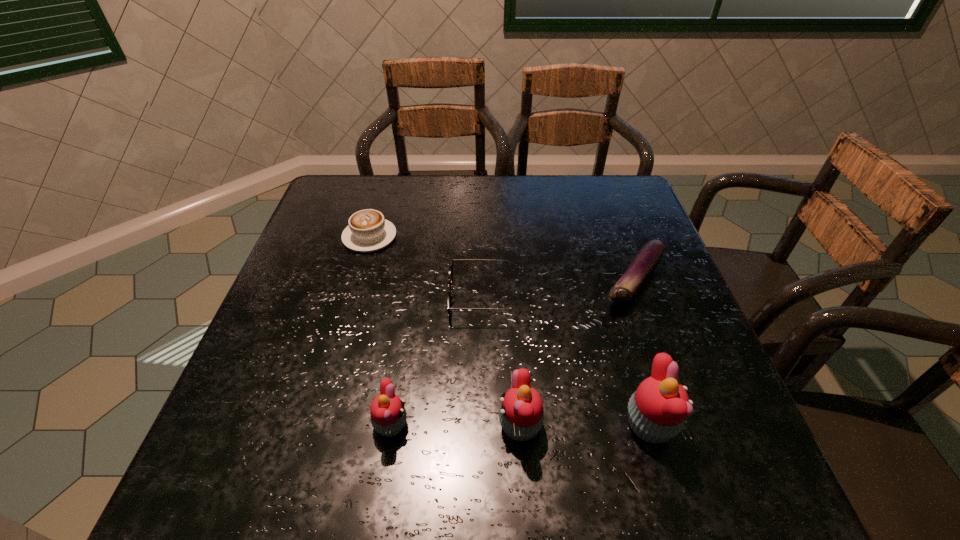
The width and height of the screenshot is (960, 540). In order to click on the leftmost cupcake in this screenshot , I will do `click(388, 415)`.

This screenshot has height=540, width=960. I want to click on the fourth shortest object, so click(x=388, y=415).

At what (x,y) coordinates should I click in order to perform the action: click on the second cupcake from left to right. Please return your answer as a coordinate pair (x, y). The height and width of the screenshot is (540, 960). Looking at the image, I should click on (521, 415).

The height and width of the screenshot is (540, 960). Find the location of `the second shortest cupcake`. the second shortest cupcake is located at coordinates (521, 415).

Where is `the tallest object`? The width and height of the screenshot is (960, 540). the tallest object is located at coordinates (656, 412).

Find the location of a particular element. This screenshot has height=540, width=960. the rightmost cupcake is located at coordinates (656, 412).

The width and height of the screenshot is (960, 540). I want to click on the leftmost object, so [x=367, y=231].

The image size is (960, 540). I want to click on eggplant, so pyautogui.click(x=648, y=257).

I want to click on spectacles, so click(450, 276).

You are a GUI agent. You are given a task and a screenshot of the screen. Output one action in this format:
    pyautogui.click(x=<x>, y=<y>)
    Task: Click on the vacant region located 0.400m on the face of the shortest cupcake
    Image resolution: width=960 pixels, height=540 pixels.
    Given the screenshot: What is the action you would take?
    pyautogui.click(x=630, y=426)